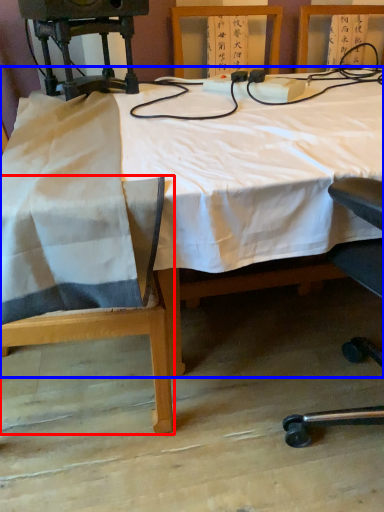
Question: Which object is closer to the camera taking this photo, chair (highlighted by a red box) or table (highlighted by a blue box)?

Choices:
 (A) chair
 (B) table

Answer: (B)